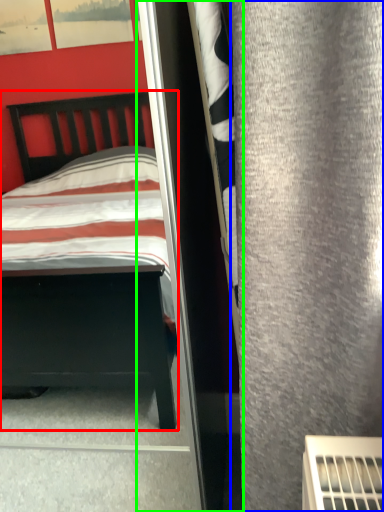
Question: Estimate the real-world distances between objects in this image. Which object is farther from bed (highlighted by a red box), curtain (highlighted by a blue box) or screen door (highlighted by a green box)?

Choices:
 (A) curtain
 (B) screen door

Answer: (A)